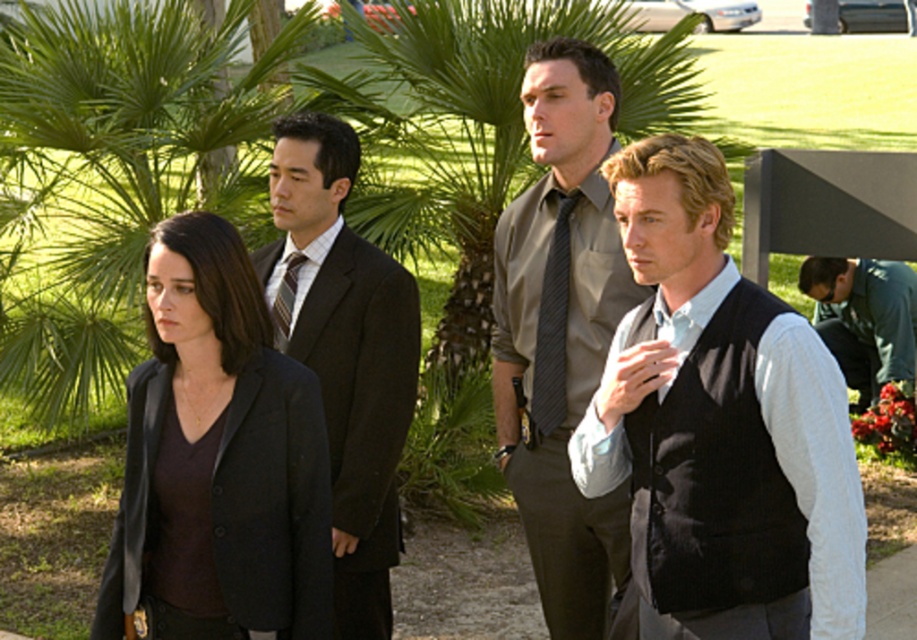
You are a photographer trying to capture a group photo of the matte black blazer at center and the striped silk tie at center. If you want to ensure both are fully visible in the frame, which object requires more horizontal space in the composition?

The matte black blazer at center requires more horizontal space in the composition because its width surpasses that of the striped silk tie at center.

You are a photographer standing at the origin point of the coordinate system. You need to adjust your camera to focus on the black textured vest at center. What are the coordinates you should set your camera to?

The coordinates to focus on the black textured vest at center are at point 0.667 on the x axis and 0.786 on the y axis.